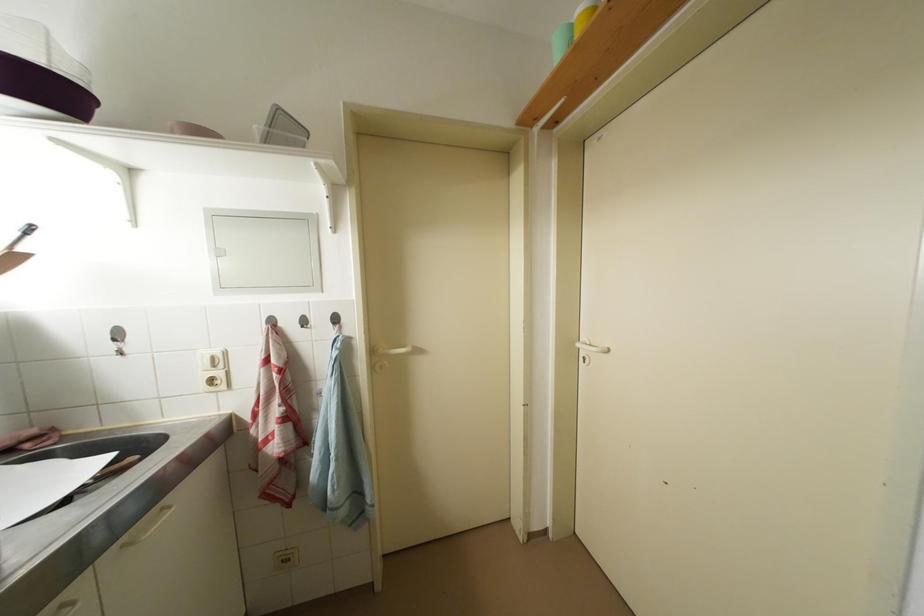
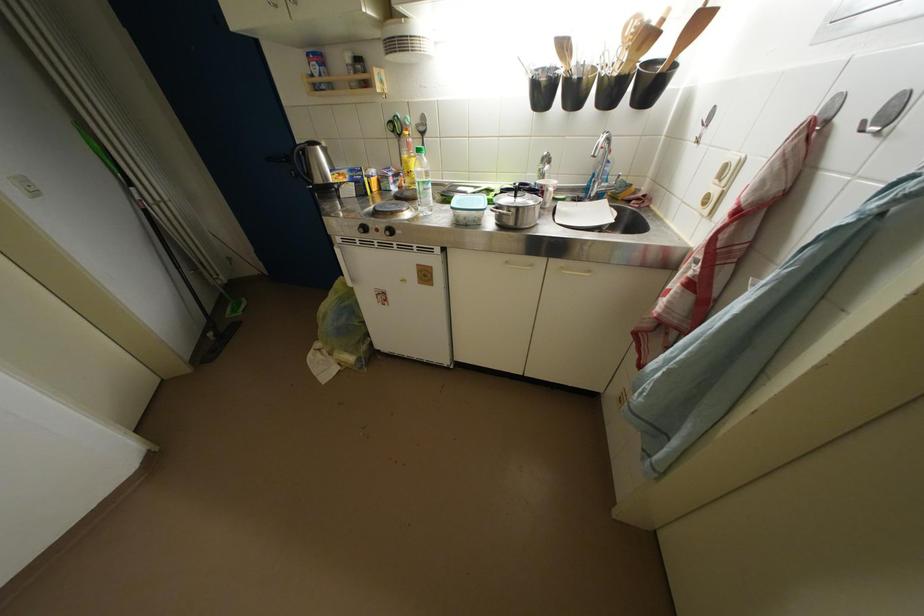
Locate, in the second image, the point that corresponds to point 310,331 in the first image.

(869, 132)